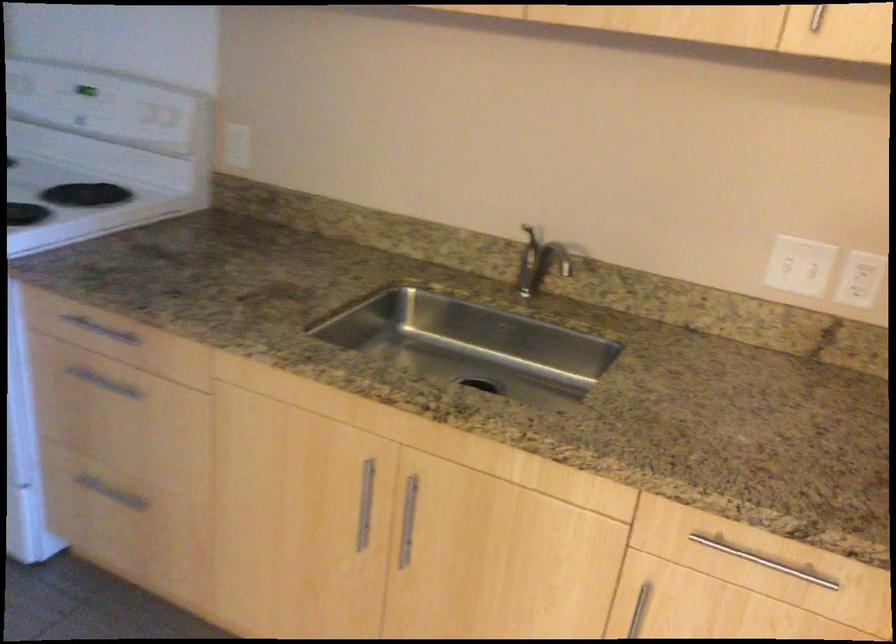
Find where to push the white rocker switch. Please return your answer as a coordinate pair (x, y).

(798, 266)